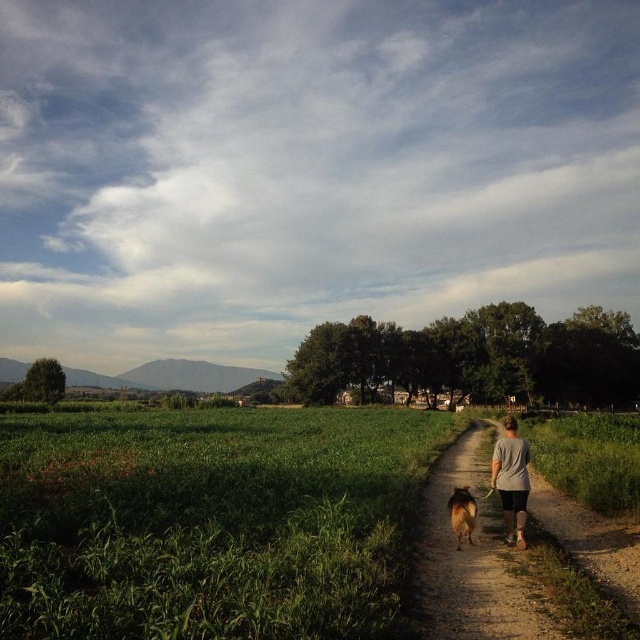
You are a hiker who wants to walk your dog along the dirt path at center. Can the brown furry dog at center walk alongside you without the path being too narrow?

The dirt path at center might be wider than brown furry dog at center, so it is possible that the path is wide enough for both you and the dog to walk comfortably side by side.

You are standing at the point marked as point (512,481). What is the color of the fabric directly beneath your feet?

The point (512,481) is on gray fabric shirt at center, so the color beneath your feet is gray.

You are planning to walk a 1.5 meter wide inflatable raft along the dirt path at center while wearing the gray fabric shirt at center. Based on the scene description, will the raft fit on the path without overlapping the shirt?

The dirt path at center is wider than the gray fabric shirt at center. Since the raft is 1.5 meters wide, and the path is wider than the shirt, it is likely that the raft can fit on the path without overlapping the shirt, provided the shirt is not obstructing the path.